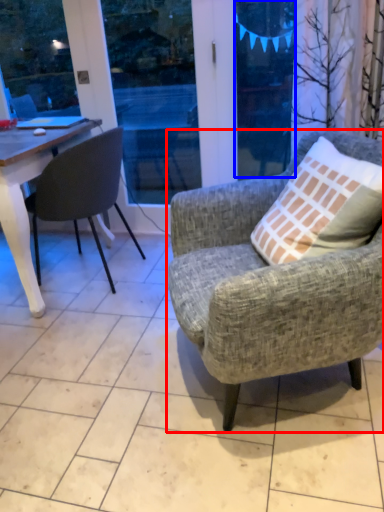
Question: Which of the following is the farthest to the observer, chair (highlighted by a red box) or window screen (highlighted by a blue box)?

Choices:
 (A) chair
 (B) window screen

Answer: (B)